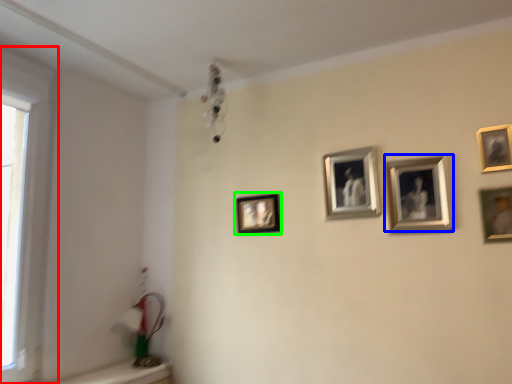
Question: Which object is positioned closest to window (highlighted by a red box)? Select from picture frame (highlighted by a blue box) and picture frame (highlighted by a green box).

Choices:
 (A) picture frame
 (B) picture frame

Answer: (B)